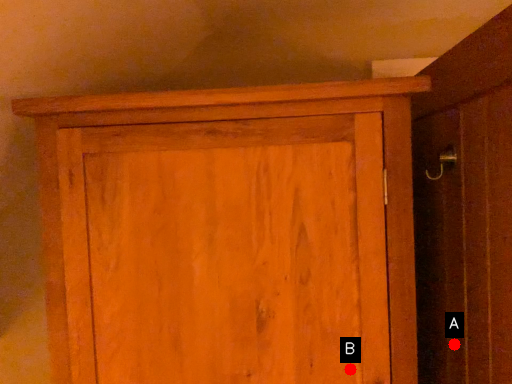
Question: Two points are circled on the image, labeled by A and B beside each circle. Which point is further to the camera?

Choices:
 (A) A is further
 (B) B is further

Answer: (A)